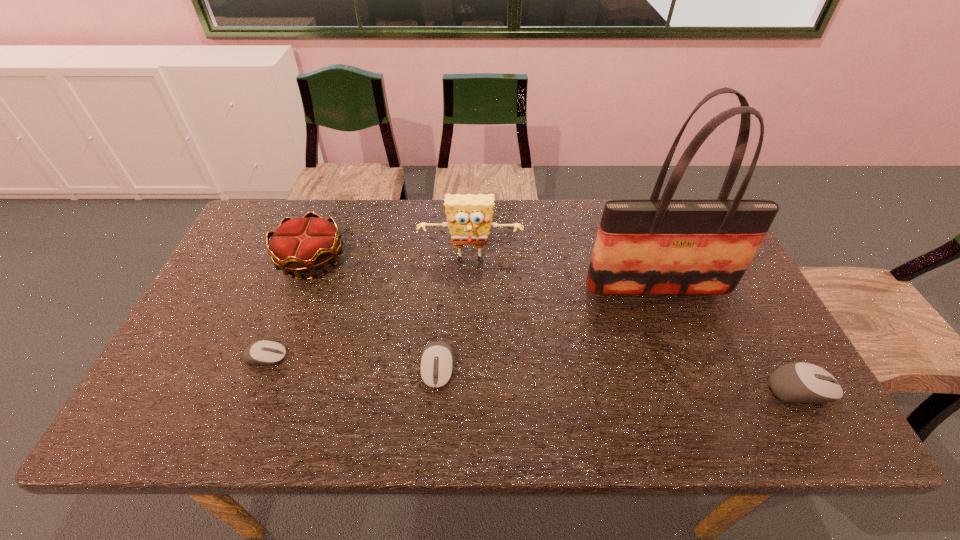
To achieve even spacing by inserting another mouse_(computer_equipment) among them, please point to a vacant spot for this new mouse_(computer_equipment). Please provide its 2D coordinates. Your answer should be formatted as a tuple, i.e. [(x, y)], where the tuple contains the x and y coordinates of a point satisfying the conditions above.

[(616, 378)]